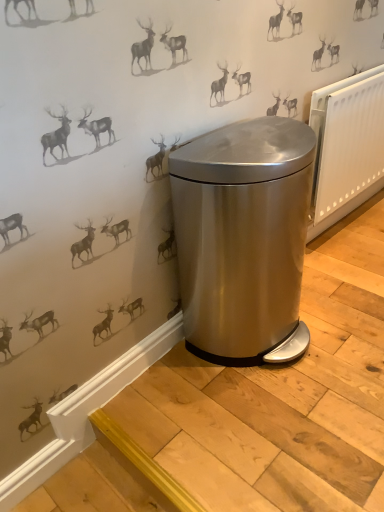
This screenshot has height=512, width=384. I want to click on free space in front of white plastic radiator at right, so click(354, 263).